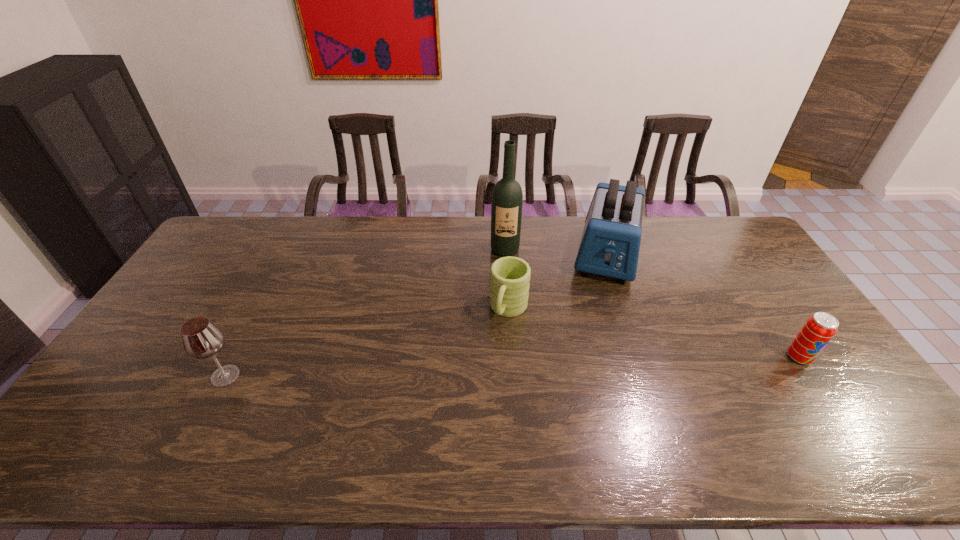
Image resolution: width=960 pixels, height=540 pixels. I want to click on object located at the right edge, so click(819, 329).

Where is `free space at the far edge`? This screenshot has width=960, height=540. free space at the far edge is located at coordinates point(447,219).

The width and height of the screenshot is (960, 540). I want to click on vacant area at the near edge of the desktop, so click(463, 404).

The height and width of the screenshot is (540, 960). What are the coordinates of `vacant space at the right edge of the desktop` in the screenshot? It's located at (788, 344).

In the image, there is a desktop. Where is `vacant space at the far left corner`? The width and height of the screenshot is (960, 540). vacant space at the far left corner is located at coordinates (237, 236).

I want to click on free space between the rightmost object and the mug, so click(654, 333).

Locate an element on the screen. free spot between the third shortest object and the wine bottle is located at coordinates (365, 313).

Find the location of a particular element. The width and height of the screenshot is (960, 540). free space between the third farthest object and the third shortest object is located at coordinates (368, 342).

The image size is (960, 540). In order to click on vacant space that is in between the third tallest object and the rightmost object in this screenshot , I will do `click(513, 366)`.

I want to click on free space between the wine bottle and the soda can, so click(652, 303).